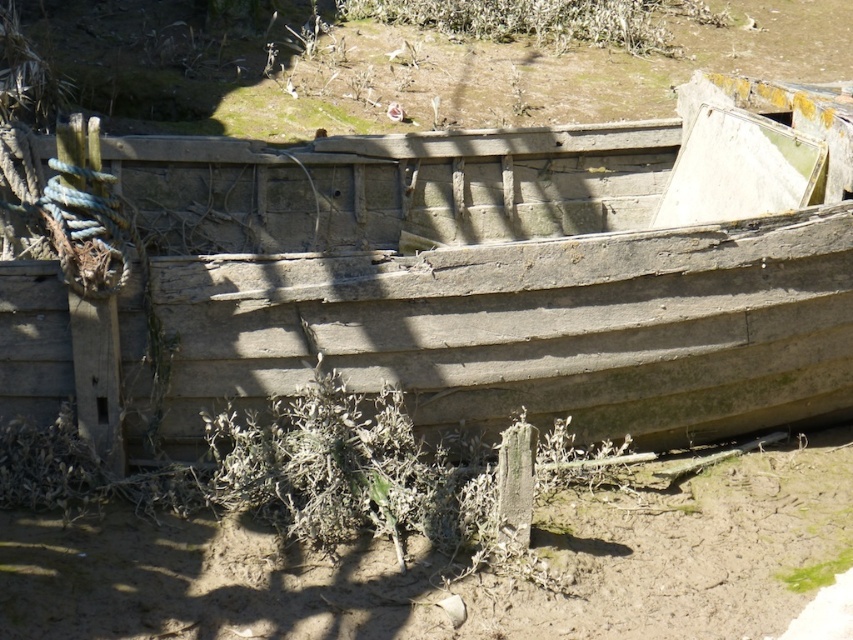
Can you confirm if brown sandy soil at lower center is positioned to the left of green leafy plant at upper center?

Indeed, brown sandy soil at lower center is positioned on the left side of green leafy plant at upper center.

Does brown sandy soil at lower center come behind green leafy plant at upper center?

No, it is not.

Is point (734, 580) behind point (556, 12)?

That is False.

What are the coordinates of `brown sandy soil at lower center` in the screenshot? It's located at 457,566.

Which is more to the left, weathered wood boat at center or brown sandy soil at lower center?

weathered wood boat at center is more to the left.

Is weathered wood boat at center shorter than brown sandy soil at lower center?

Incorrect, weathered wood boat at center's height does not fall short of brown sandy soil at lower center's.

I want to click on weathered wood boat at center, so pyautogui.click(x=462, y=275).

Does weathered wood boat at center have a greater height compared to green leafy plant at upper center?

Indeed, weathered wood boat at center has a greater height compared to green leafy plant at upper center.

Is point (177, 180) farther from viewer compared to point (715, 12)?

No.

Who is more distant from viewer, [270,326] or [573,19]?

Point [573,19]

Identify the location of weathered wood boat at center. The height and width of the screenshot is (640, 853). (462, 275).